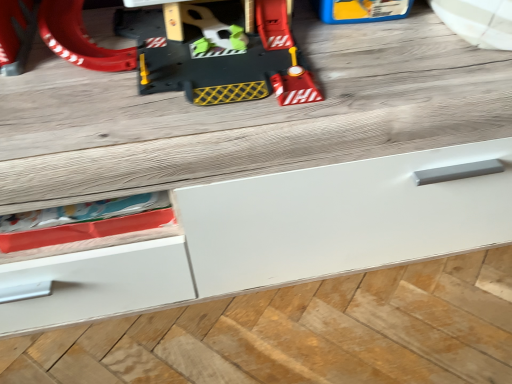
The height and width of the screenshot is (384, 512). I want to click on free point below plastic toy train at upper center (from a real-world perspective), so click(x=178, y=56).